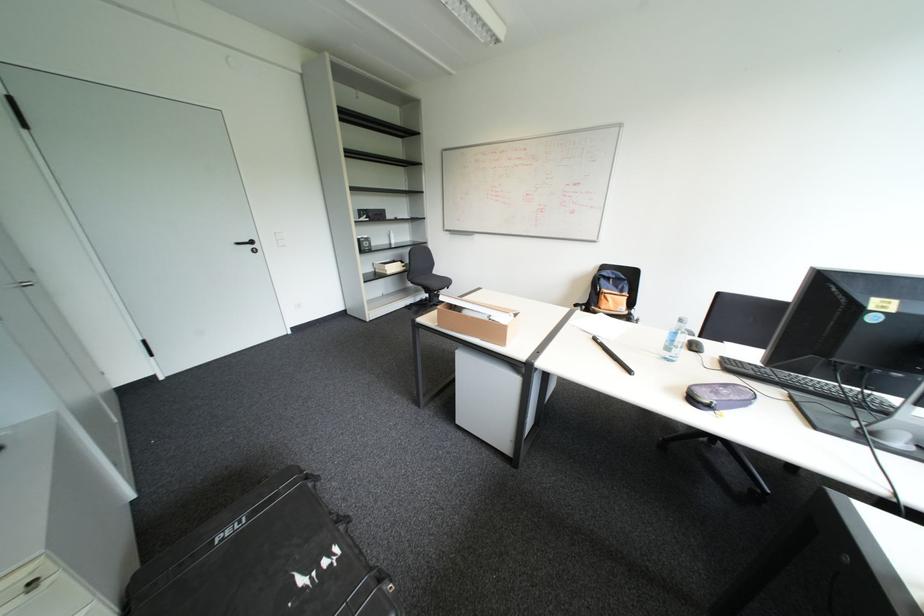
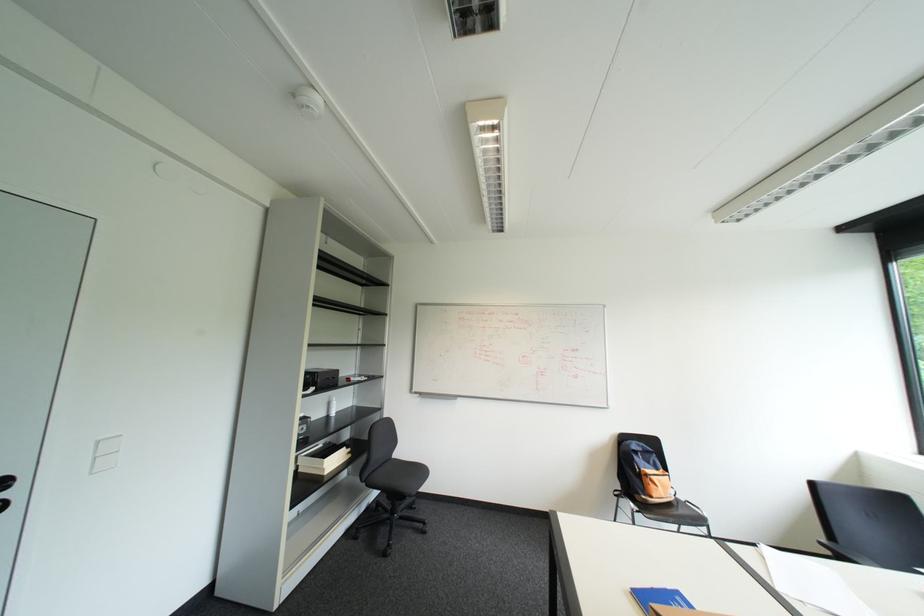
In the second image, find the point that corresponds to (283,232) in the first image.

(107, 440)